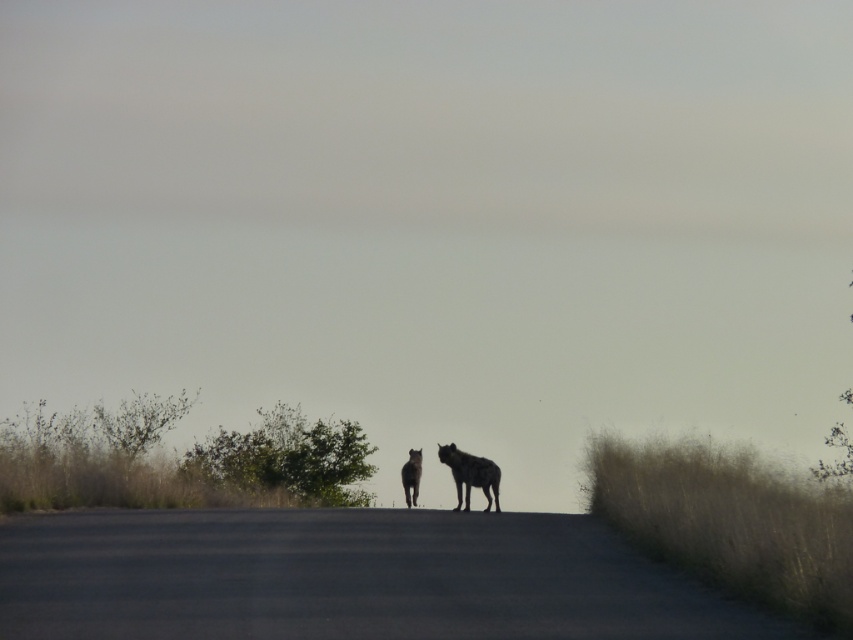
Question: Among these objects, which one is farthest from the camera?

Choices:
 (A) spotted fur hyena at center
 (B) black fur hyena at center

Answer: (B)

Question: Is spotted fur hyena at center further to camera compared to black fur hyena at center?

Choices:
 (A) yes
 (B) no

Answer: (B)

Question: Which of the following is the closest to the observer?

Choices:
 (A) (419, 476)
 (B) (482, 476)

Answer: (B)

Question: Can you confirm if spotted fur hyena at center is positioned below black fur hyena at center?

Choices:
 (A) yes
 (B) no

Answer: (B)

Question: Is the position of spotted fur hyena at center less distant than that of black fur hyena at center?

Choices:
 (A) no
 (B) yes

Answer: (B)

Question: Among these points, which one is farthest from the camera?

Choices:
 (A) tap(419, 449)
 (B) tap(456, 509)

Answer: (A)